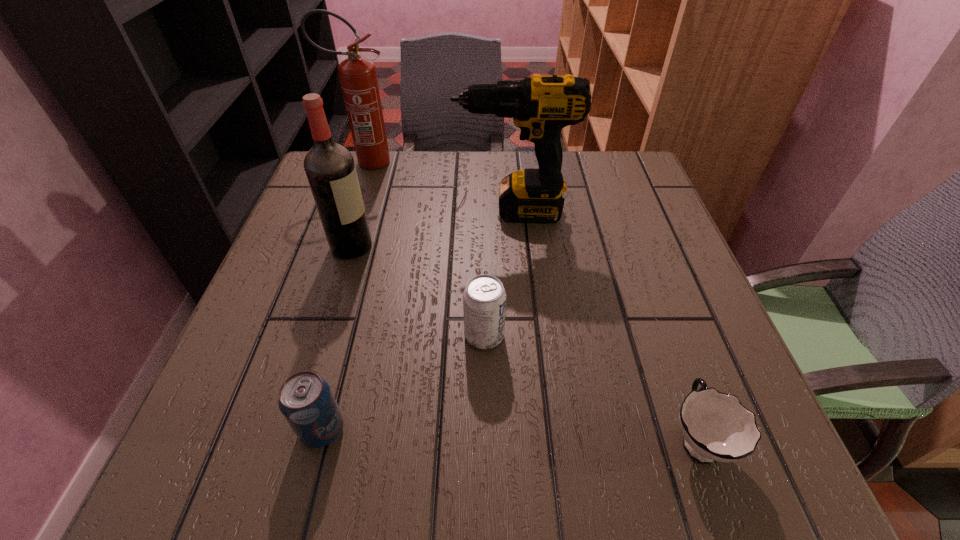
This screenshot has height=540, width=960. I want to click on the farthest object, so click(358, 77).

Where is `the fourth nearest object`? The image size is (960, 540). the fourth nearest object is located at coordinates (330, 168).

The width and height of the screenshot is (960, 540). Identify the location of the fifth nearest object. (541, 106).

You are a GUI agent. You are given a task and a screenshot of the screen. Output one action in this format:
    pyautogui.click(x=<x>, y=<y>)
    Task: Click on the farther pop soda
    This screenshot has width=960, height=540.
    Given the screenshot: What is the action you would take?
    pyautogui.click(x=484, y=299)

At what (x,y) coordinates should I click in order to perform the action: click on the right pop soda. Please return your answer as a coordinate pair (x, y). Image resolution: width=960 pixels, height=540 pixels. Looking at the image, I should click on (484, 299).

At what (x,y) coordinates should I click in order to perform the action: click on the nearer pop soda. Please return your answer as a coordinate pair (x, y). Looking at the image, I should click on (306, 401).

The width and height of the screenshot is (960, 540). Identify the location of the rightmost object. [x=715, y=426].

In order to click on the shortest object in this screenshot , I will do `click(715, 426)`.

The width and height of the screenshot is (960, 540). I want to click on vacant space located 0.250m from the nozzle of the farthest object, so click(x=492, y=162).

Identify the location of free space located 0.310m on the front-facing side of the liquor. (519, 246).